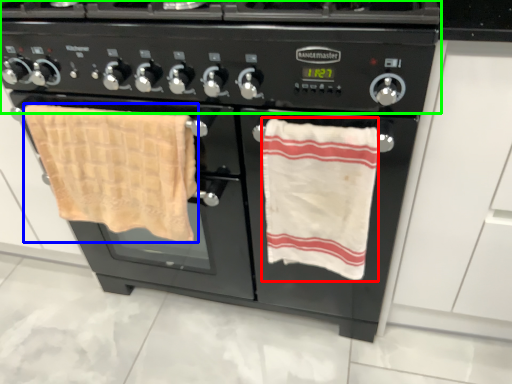
Question: Which object is positioned closest to beach towel (highlighted by a red box)? Select from beach towel (highlighted by a blue box) and gas stove (highlighted by a green box).

Choices:
 (A) beach towel
 (B) gas stove

Answer: (B)